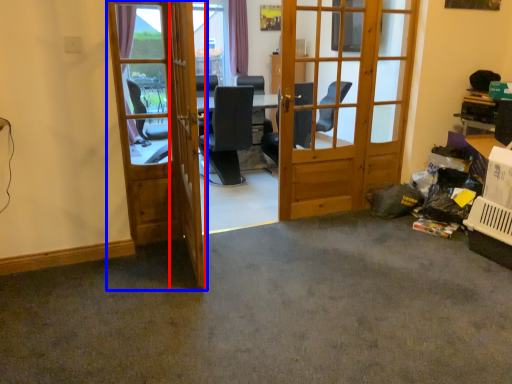
Question: Which point is further to the camera, screen door (highlighted by a red box) or door (highlighted by a blue box)?

Choices:
 (A) screen door
 (B) door

Answer: (B)